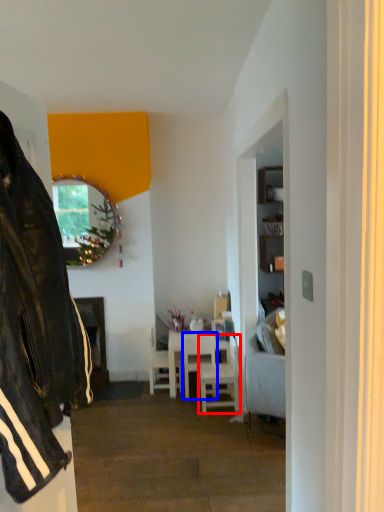
Question: Which point is closer to the camera, chair (highlighted by a red box) or chair (highlighted by a blue box)?

Choices:
 (A) chair
 (B) chair

Answer: (A)